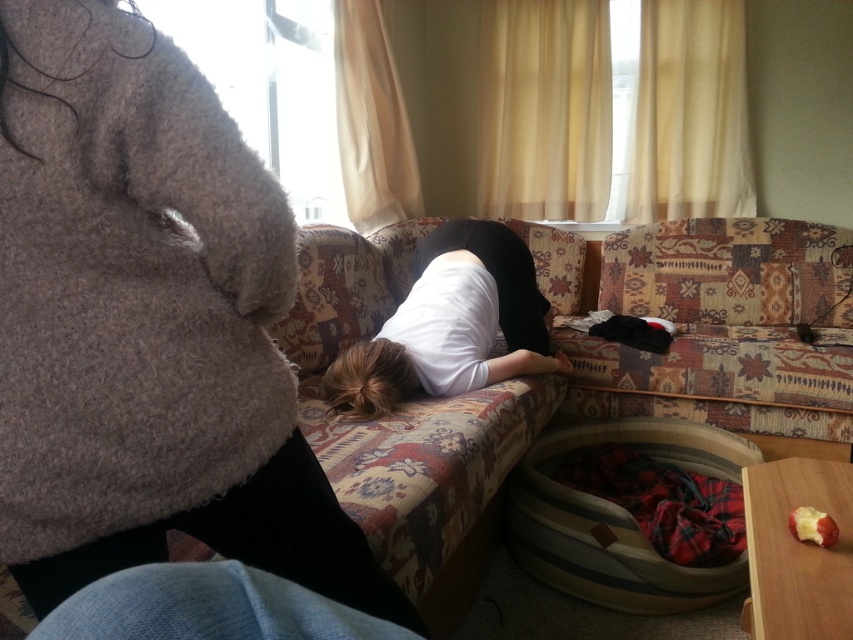
Who is shorter, fuzzy beige sweater at upper left or wooden pet bed at lower right?

With less height is wooden pet bed at lower right.

Which is more to the right, fuzzy beige sweater at upper left or wooden pet bed at lower right?

wooden pet bed at lower right

Find the location of a particular element. This screenshot has height=640, width=853. fuzzy beige sweater at upper left is located at coordinates (148, 324).

Find the location of `fuzzy beige sweater at upper left`. fuzzy beige sweater at upper left is located at coordinates (148, 324).

Measure the distance between wooden pet bed at lower right and camera.

5.46 feet

Is wooden pet bed at lower right further to the viewer compared to white matte shirt at center?

No, wooden pet bed at lower right is in front of white matte shirt at center.

The image size is (853, 640). I want to click on wooden pet bed at lower right, so click(618, 518).

Between point (329, 561) and point (453, 337), which one is positioned in front?

Positioned in front is point (329, 561).

Is point (340, 528) closer to viewer compared to point (416, 384)?

That is True.

Is point (120, 360) behind point (544, 332)?

No, (120, 360) is closer to viewer.

This screenshot has width=853, height=640. What are the coordinates of `fuzzy beige sweater at upper left` in the screenshot? It's located at (148, 324).